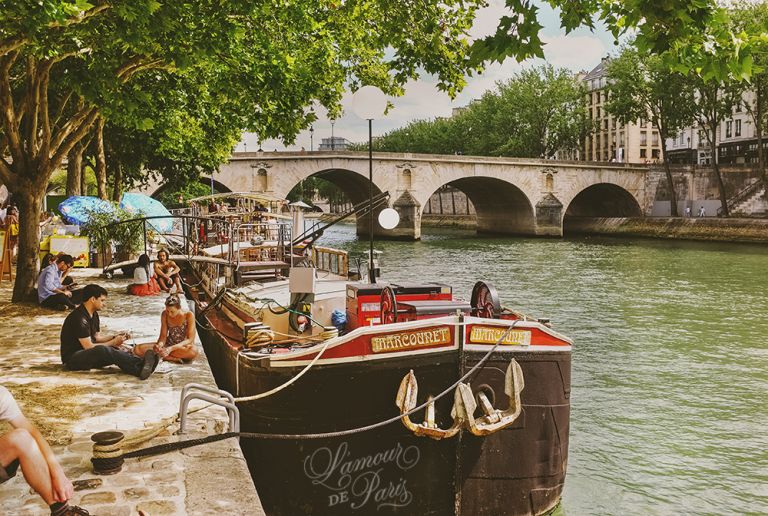
The width and height of the screenshot is (768, 516). What are the coordinates of `archways` in the screenshot? It's located at (181, 195), (323, 195), (495, 206), (604, 200).